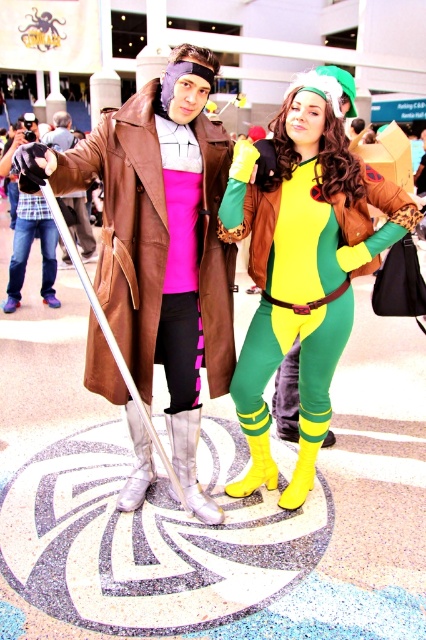
Between green spandex suit at center and matte brown coat at center, which one has less height?

matte brown coat at center is shorter.

The image size is (426, 640). What do you see at coordinates (302, 264) in the screenshot?
I see `green spandex suit at center` at bounding box center [302, 264].

Where is `green spandex suit at center`? Image resolution: width=426 pixels, height=640 pixels. green spandex suit at center is located at coordinates (302, 264).